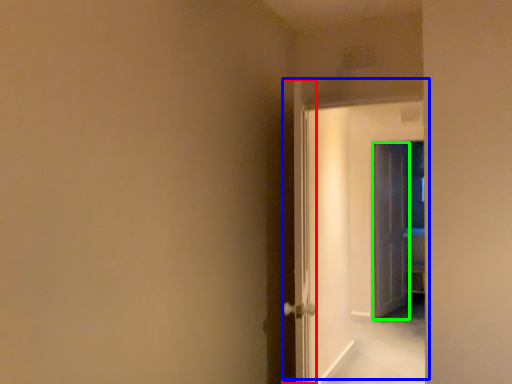
Question: Estimate the real-world distances between objects in this image. Which object is closer to door (highlighted by a red box), door (highlighted by a blue box) or door (highlighted by a green box)?

Choices:
 (A) door
 (B) door

Answer: (A)